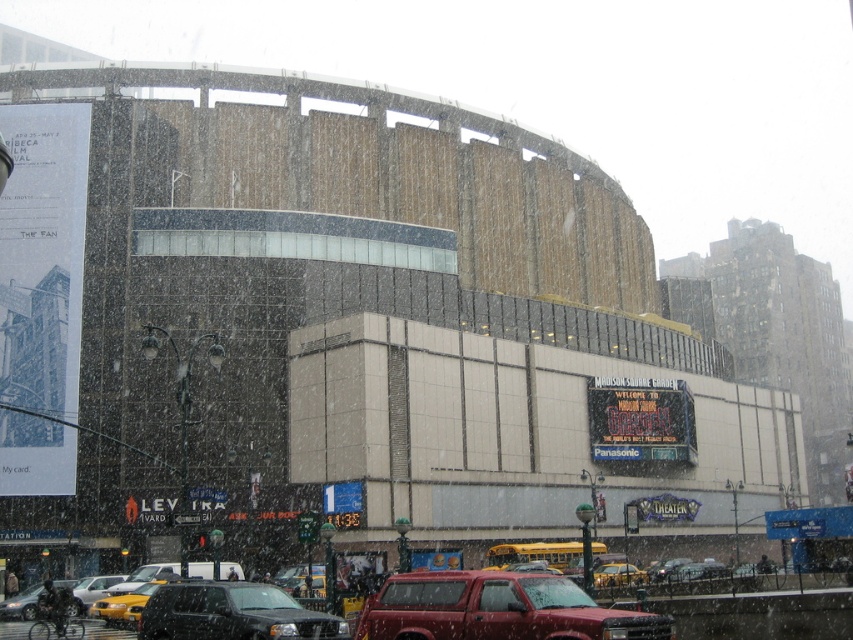
Question: Estimate the real-world distances between objects in this image. Which object is farther from the yellow matte taxi at center?

Choices:
 (A) yellow rubber taxi at center
 (B) black matte suv at lower center
 (C) metallic silver sedan at lower left

Answer: (B)

Question: Is black matte suv at lower center above yellow matte taxi at center?

Choices:
 (A) yes
 (B) no

Answer: (A)

Question: Is black matte suv at lower center closer to the viewer compared to metallic silver sedan at lower left?

Choices:
 (A) no
 (B) yes

Answer: (B)

Question: Which object is the closest to the yellow matte taxi at lower left?

Choices:
 (A) matte black car at lower left
 (B) black matte suv at lower center
 (C) yellow rubber taxi at center
 (D) yellow matte taxi at center

Answer: (A)

Question: Is matte red truck at center to the right of metallic silver sedan at lower left from the viewer's perspective?

Choices:
 (A) yes
 (B) no

Answer: (A)

Question: Estimate the real-world distances between objects in this image. Which object is farther from the yellow matte taxi at lower left?

Choices:
 (A) yellow matte taxi at center
 (B) matte red truck at center

Answer: (A)